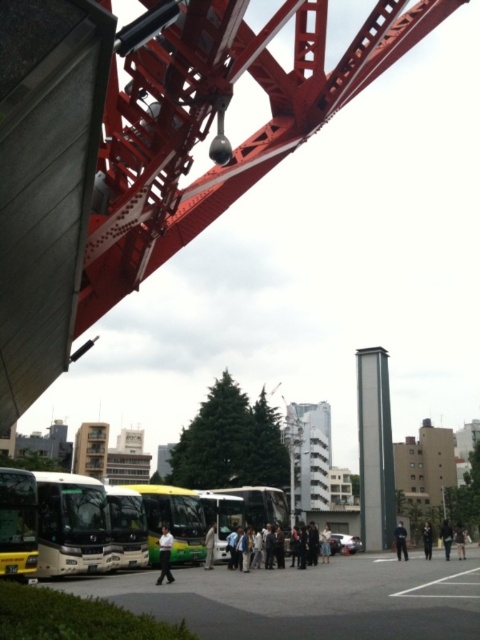
Is dark gray fabric jacket at center thinner than black fabric person at lower center?

No.

Does dark gray fabric jacket at center appear on the left side of black fabric person at lower center?

No, dark gray fabric jacket at center is not to the left of black fabric person at lower center.

Who is more forward, (444, 532) or (424, 522)?

Point (444, 532) is in front.

Locate an element on the screen. The image size is (480, 640). dark gray fabric jacket at center is located at coordinates (446, 538).

Is yellow-green metallic bus at lower left wider than light brown leather jacket at center?

Indeed, yellow-green metallic bus at lower left has a greater width compared to light brown leather jacket at center.

Is point (8, 483) behind point (211, 529)?

That is False.

Does point (10, 536) come closer to viewer compared to point (213, 563)?

Yes, point (10, 536) is closer to viewer.

At what (x,y) coordinates should I click in order to perform the action: click on yellow-green metallic bus at lower left. Please return your answer as a coordinate pair (x, y). The height and width of the screenshot is (640, 480). Looking at the image, I should click on (17, 524).

Who is taller, dark gray suit at center or white cotton shirt at center?

Standing taller between the two is white cotton shirt at center.

Can you confirm if dark gray suit at center is smaller than white cotton shirt at center?

Yes.

Is point (264, 540) more distant than point (325, 529)?

No, (264, 540) is in front of (325, 529).

I want to click on dark gray suit at center, so click(x=274, y=547).